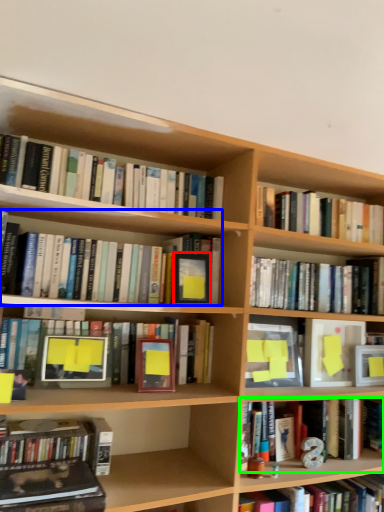
Question: Which object is positioned farthest from paperback book (highlighted by a red box)? Select from book (highlighted by a blue box) and book (highlighted by a green box).

Choices:
 (A) book
 (B) book

Answer: (B)